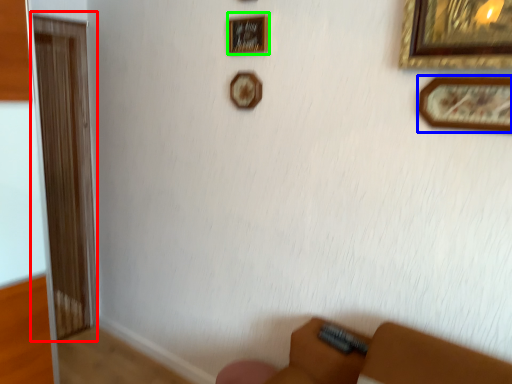
Question: Based on their relative distances, which object is nearer to screen door (highlighted by a red box)? Choose from picture frame (highlighted by a blue box) and picture frame (highlighted by a green box).

Choices:
 (A) picture frame
 (B) picture frame

Answer: (B)